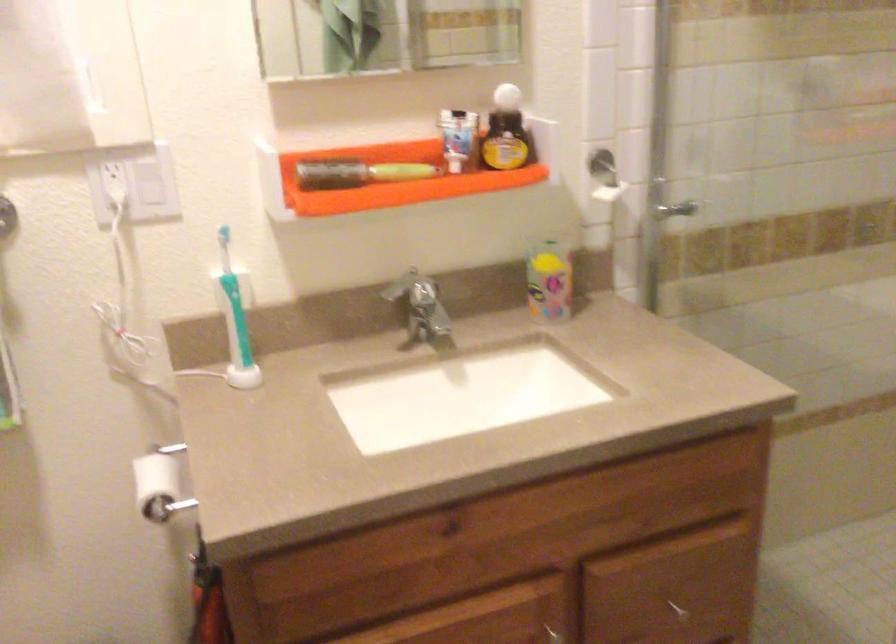
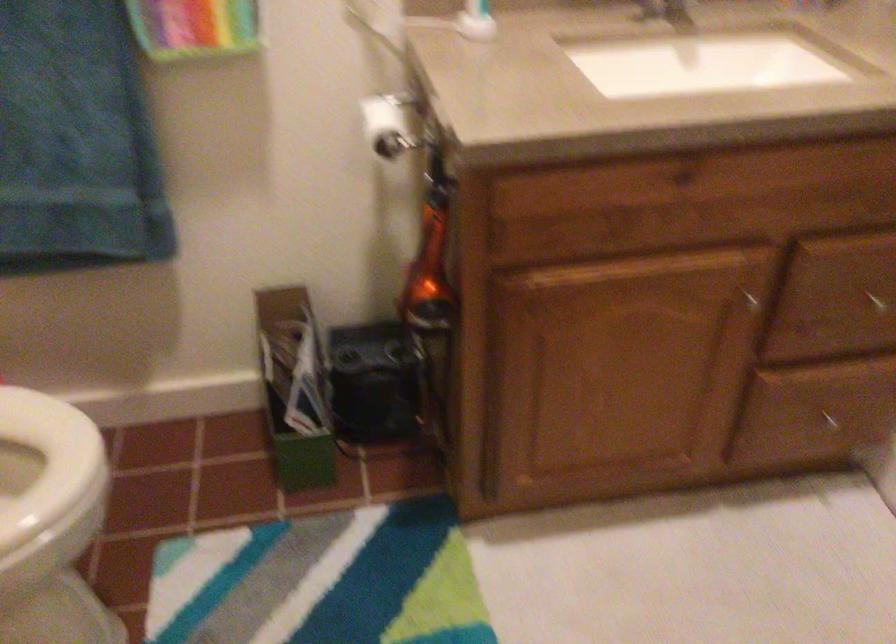
Where in the second image is the point corresponding to pixel 158 491 from the first image?

(388, 125)